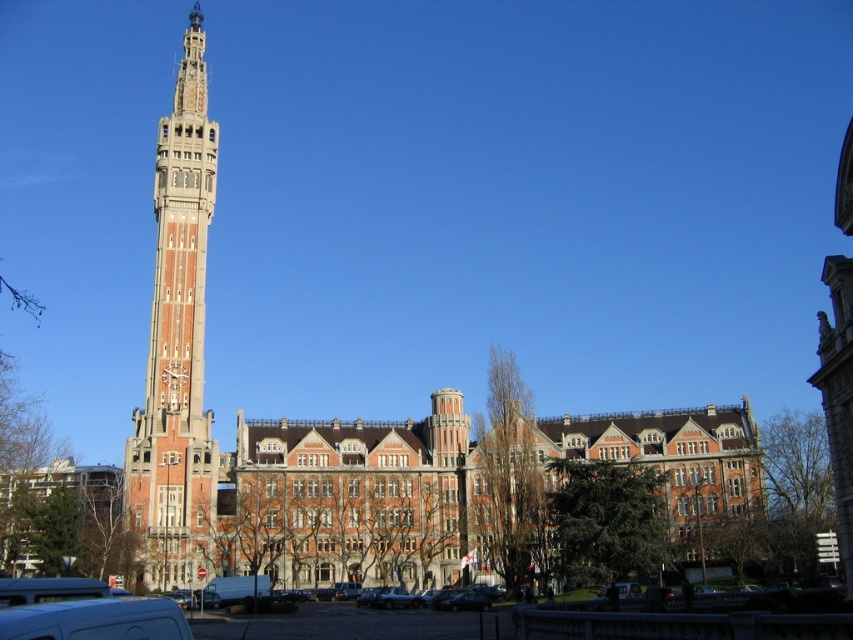
Can you confirm if red brick clock tower at left is wider than white matte van at lower left?

Indeed, red brick clock tower at left has a greater width compared to white matte van at lower left.

Who is lower down, red brick clock tower at left or white matte van at lower left?

white matte van at lower left is below.

This screenshot has height=640, width=853. I want to click on red brick clock tower at left, so click(x=177, y=346).

Locate an element on the screen. The width and height of the screenshot is (853, 640). red brick clock tower at left is located at coordinates (177, 346).